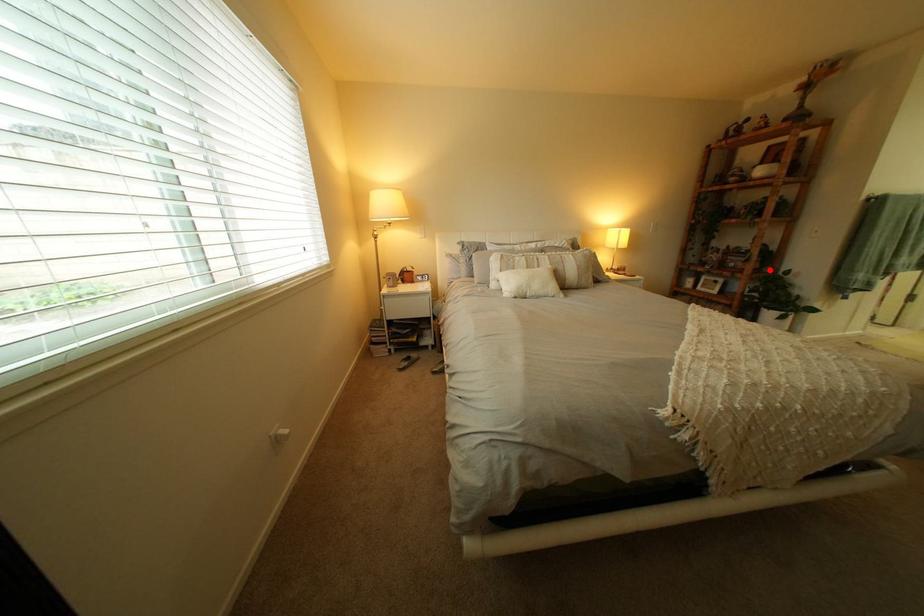
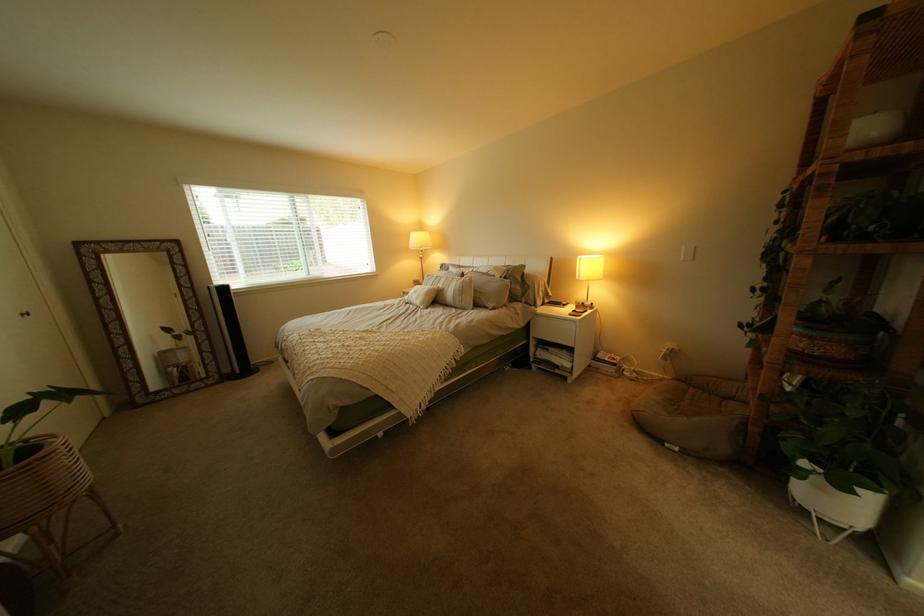
Locate, in the second image, the point that corresponds to the highlighted location in the first image.

(805, 354)